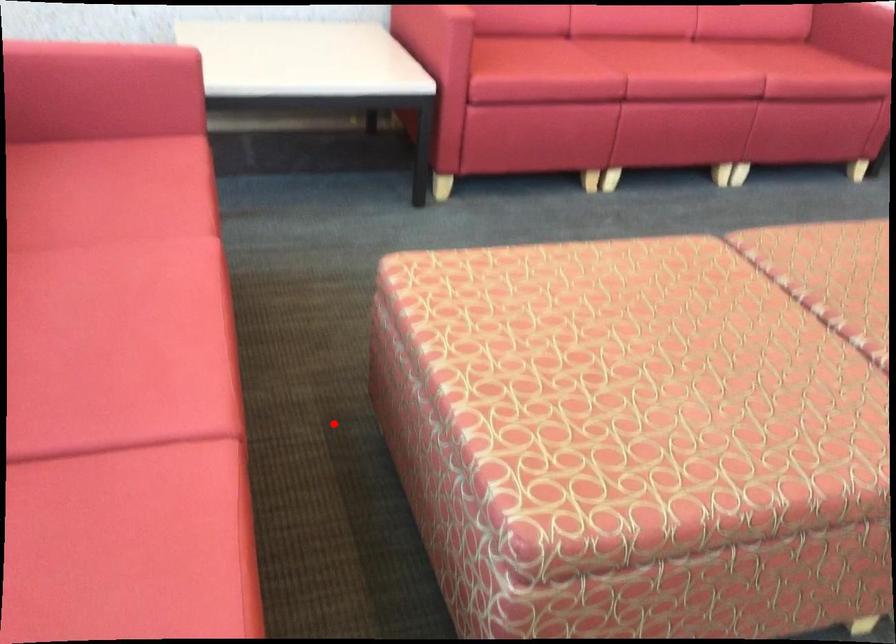
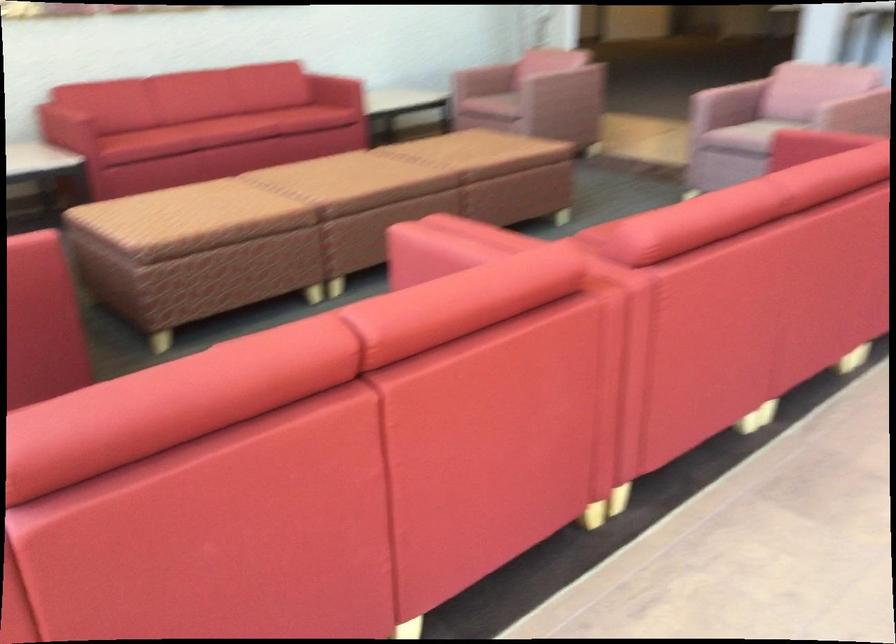
Question: I am providing you with two images of the same scene from different viewpoints. A red point is marked on the first image. At the location where the point appears in image 1, is it still visible in image 2?

Choices:
 (A) Yes
 (B) No

Answer: (B)